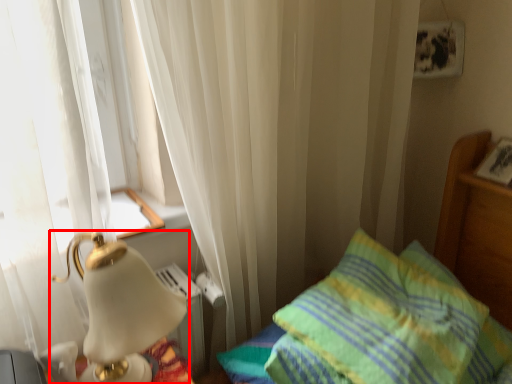
Question: From the image's perspective, where is lamp (annotated by the red box) located in relation to pillow in the image?

Choices:
 (A) below
 (B) above

Answer: (B)